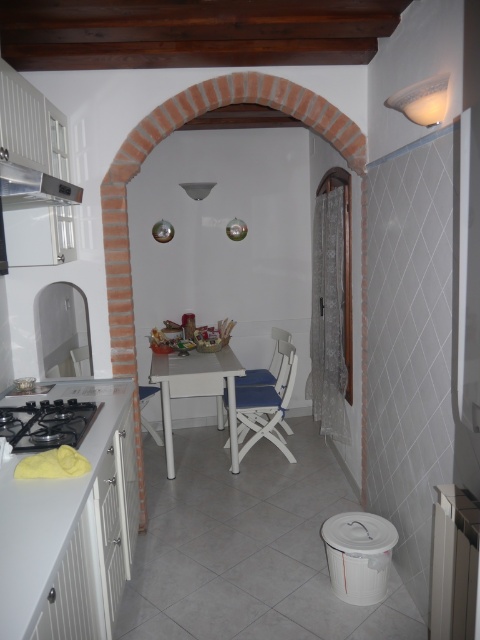
Question: Which object is farther from the camera taking this photo?

Choices:
 (A) satin silver metallic exhaust hood at upper left
 (B) blue fabric chair at center

Answer: (B)

Question: Can you confirm if black matte stove at lower left is positioned to the left of blue fabric chair at center?

Choices:
 (A) no
 (B) yes

Answer: (B)

Question: Is white glossy table at center further to camera compared to satin silver metallic exhaust hood at upper left?

Choices:
 (A) no
 (B) yes

Answer: (B)

Question: Which object is farther from the camera taking this photo?

Choices:
 (A) blue fabric chair at center
 (B) satin silver metallic exhaust hood at upper left
 (C) white glossy table at center

Answer: (A)

Question: Which object is closer to the camera taking this photo?

Choices:
 (A) white glossy table at center
 (B) blue fabric chair at center
 (C) satin silver metallic exhaust hood at upper left
 (D) black matte stove at lower left

Answer: (C)

Question: Can you confirm if black matte stove at lower left is smaller than satin silver metallic exhaust hood at upper left?

Choices:
 (A) yes
 (B) no

Answer: (A)